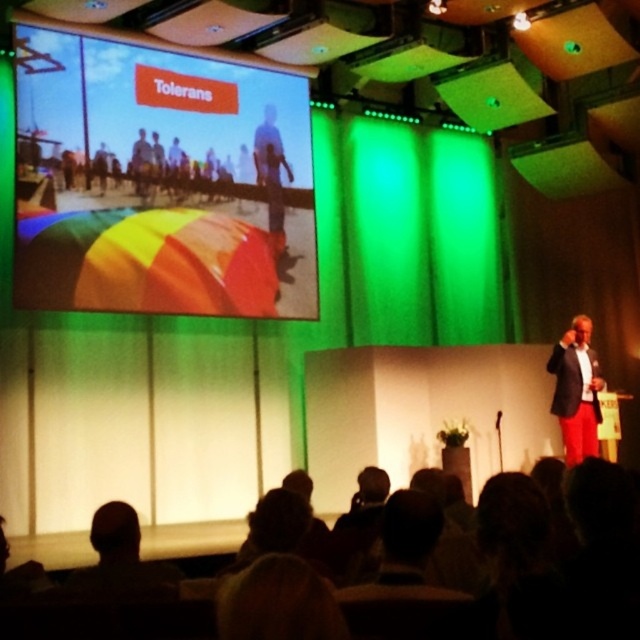
You are an event planner assessing the stage setup. The rainbow fabric umbrella at upper left and the matte black suit at right are both part of the presentation. Which object occupies more visual space in the scene?

The rainbow fabric umbrella at upper left has a larger size compared to the matte black suit at right, so it occupies more visual space in the scene.

You are an attendee at the presentation. You need to locate the speaker who is wearing a matte black suit at right. Which direction should you look relative to the rainbow fabric umbrella at upper left?

The rainbow fabric umbrella at upper left is to the left of the matte black suit at right, so you should look to the right from the rainbow fabric umbrella at upper left to find the speaker wearing the matte black suit at right.